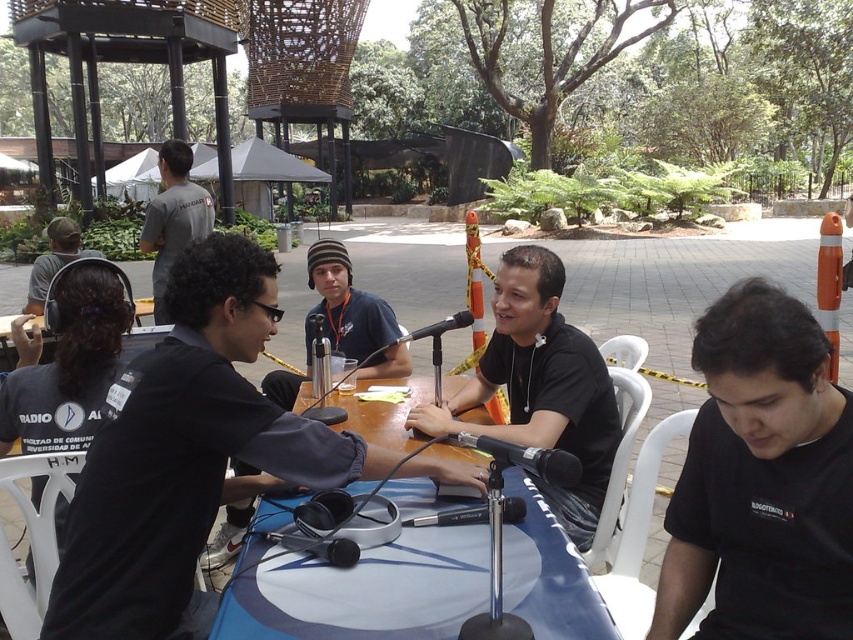
Question: Among these points, which one is nearest to the camera?

Choices:
 (A) (807, 435)
 (B) (408, 372)
 (C) (438, 467)

Answer: (A)

Question: Does black matte headphones at center have a smaller size compared to matte black headphones at left?

Choices:
 (A) no
 (B) yes

Answer: (B)

Question: Does black metallic microphone at center appear over black matte microphone at center?

Choices:
 (A) no
 (B) yes

Answer: (A)

Question: Is blue fabric table at center below black matte microphone at center?

Choices:
 (A) yes
 (B) no

Answer: (A)

Question: Which object is the closest to the metallic silver microphone at center?

Choices:
 (A) black metallic microphone at center
 (B) black matte shirt at lower right
 (C) matte black headphones at left

Answer: (A)

Question: Which of the following is the closest to the observer?

Choices:
 (A) metallic silver microphone at center
 (B) black matte shirt at center

Answer: (A)